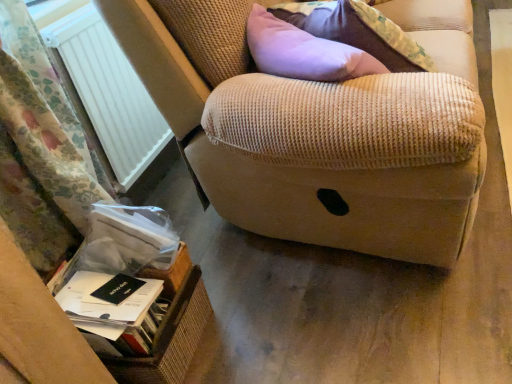
Question: Is white plastic radiator at left wider or thinner than beige corduroy armrest at upper right?

Choices:
 (A) wide
 (B) thin

Answer: (B)

Question: Relative to beige corduroy armrest at upper right, is white plastic radiator at left in front or behind?

Choices:
 (A) behind
 (B) front

Answer: (A)

Question: Which object is the closest to the white plastic radiator at left?

Choices:
 (A) white paper at lower left, which appears as the first paperback book when ordered from the bottom
 (B) brown wicker basket at lower left
 (C) black matte paperback book at lower left, the 1th paperback book viewed from the top
 (D) beige corduroy armrest at upper right
 (E) floral fabric curtain at left

Answer: (E)

Question: Estimate the real-world distances between objects in this image. Which object is closer to the beige corduroy armrest at upper right?

Choices:
 (A) white paper at lower left, the second paperback book from the top
 (B) brown wicker basket at lower left
 (C) floral fabric curtain at left
 (D) white plastic radiator at left
 (E) black matte paperback book at lower left, the 1th paperback book viewed from the top

Answer: (B)